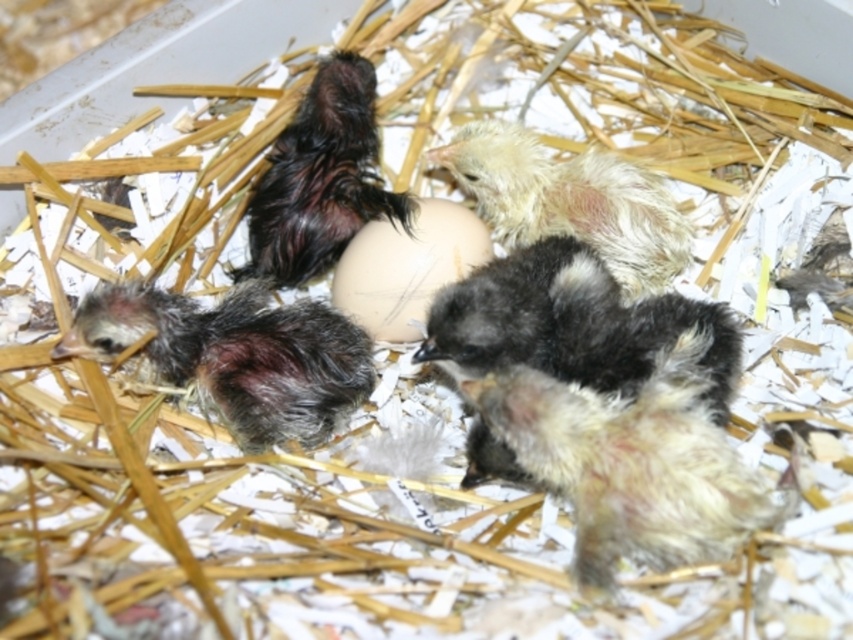
Which is more to the left, fluffy white chicken at center or dark gray fluffy chick at center?

From the viewer's perspective, dark gray fluffy chick at center appears more on the left side.

Is point (688, 560) positioned before point (311, 435)?

Yes.

Does point (569, 403) lie behind point (257, 413)?

No, it is not.

The image size is (853, 640). In order to click on fluffy white chicken at center in this screenshot , I will do `click(631, 461)`.

Who is lower down, fluffy black chick at center or white smooth egg at center?

fluffy black chick at center is lower down.

Is the position of fluffy black chick at center more distant than that of white smooth egg at center?

No, fluffy black chick at center is closer to the viewer.

Where is `fluffy black chick at center`? This screenshot has height=640, width=853. fluffy black chick at center is located at coordinates (570, 323).

Can you confirm if fluffy white chicken at center is smaller than white smooth egg at center?

No.

Is fluffy white chicken at center taller than white smooth egg at center?

Yes.

Does point (679, 502) come behind point (355, 288)?

No, (679, 502) is in front of (355, 288).

You are a GUI agent. You are given a task and a screenshot of the screen. Output one action in this format:
    pyautogui.click(x=<x>, y=<y>)
    Task: Click on the fluffy white chicken at center
    
    Given the screenshot: What is the action you would take?
    pyautogui.click(x=631, y=461)